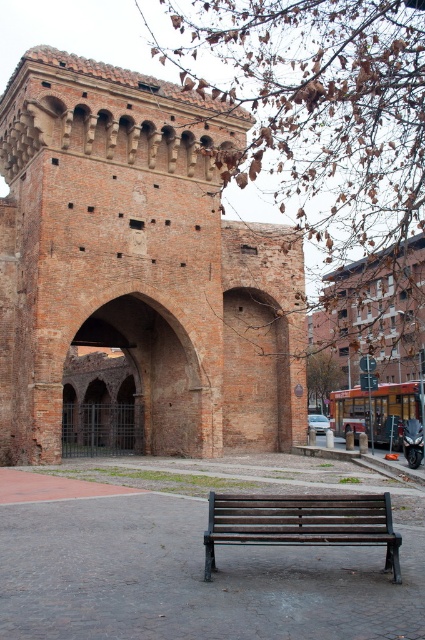
Is point (175, 364) more distant than point (147, 364)?

No.

From the picture: Is brick/tiled fort at center behind brick archway at center?

No, it is in front of brick archway at center.

What do you see at coordinates (138, 264) in the screenshot?
I see `brick/tiled fort at center` at bounding box center [138, 264].

Identify the location of brick/tiled fort at center. The width and height of the screenshot is (425, 640). (138, 264).

Between point (231, 340) and point (362, 515), which one is positioned behind?

Point (231, 340)

Describe the element at coordinates (138, 264) in the screenshot. The height and width of the screenshot is (640, 425). I see `brick/tiled fort at center` at that location.

Describe the element at coordinates (138, 264) in the screenshot. This screenshot has height=640, width=425. I see `brick/tiled fort at center` at that location.

Identify the location of brick/tiled fort at center. (138, 264).

Between brick archway at center and wooden bench at center, which one appears on the left side from the viewer's perspective?

brick archway at center

Between point (153, 422) and point (331, 545), which one is positioned in front?

Point (331, 545) is in front.

Locate an element on the screen. This screenshot has height=640, width=425. brick archway at center is located at coordinates (153, 371).